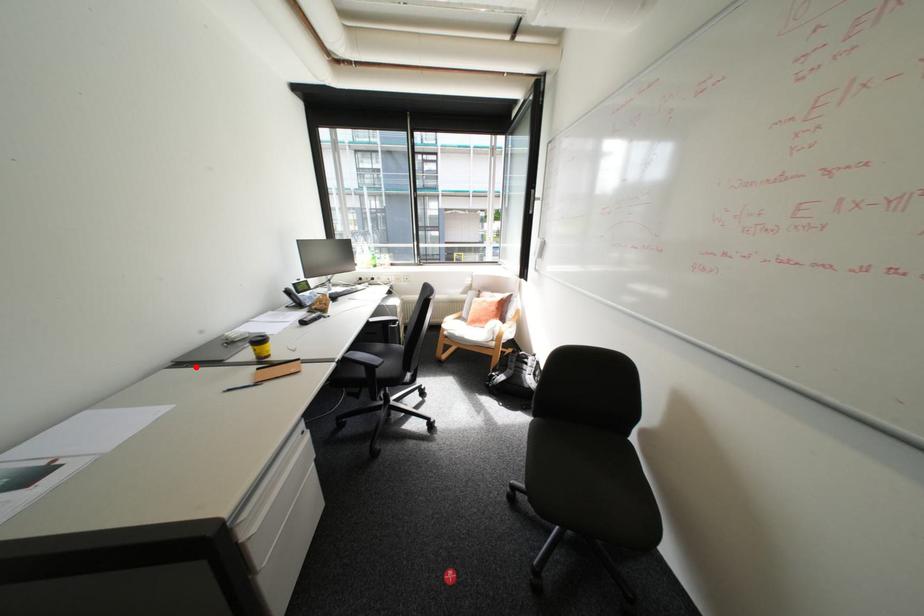
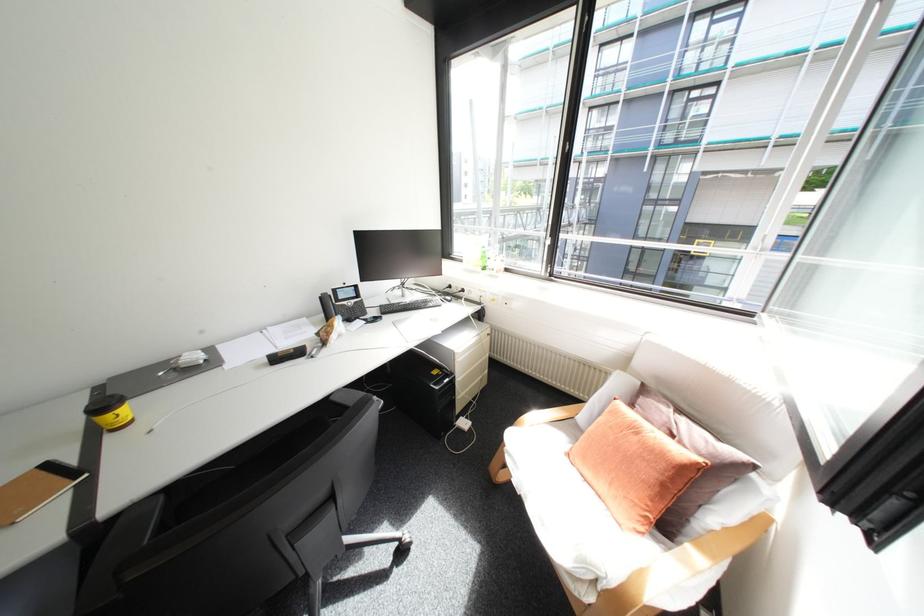
Question: I am providing you with two images of the same scene from different viewpoints. Given a red point in image1, look at the same physical point in image2. Is it:

Choices:
 (A) Closer to the viewpoint
 (B) Farther from the viewpoint

Answer: (B)